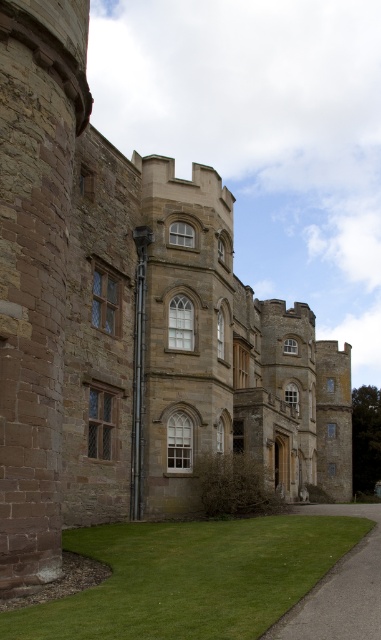
You are a gardener planning to mow the lawn. You see the green grass at lower center and the gray asphalt driveway at lower right. Which area requires mowing?

The green grass at lower center requires mowing because it is the grassy area, whereas the gray asphalt driveway at lower right is an asphalt surface and does not need mowing.

You are a gardener planning to install a sprinkler system. The sprinkler has a maximum range of 25 feet. You need to water both the green grass at lower center and the gray asphalt driveway at lower right. Can the sprinkler reach both areas from the grass?

The green grass at lower center and gray asphalt driveway at lower right are 25.51 feet apart. Since the sprinkler can only reach 25 feet, it cannot cover both areas from the grass.